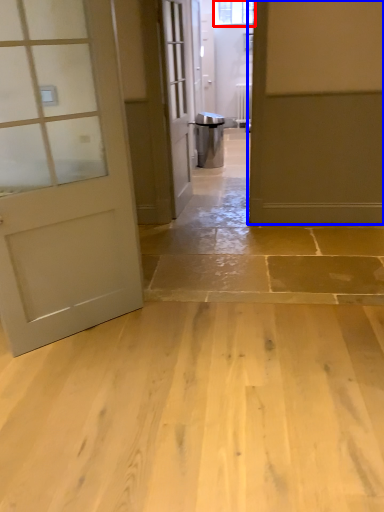
Question: Which object appears farthest to the camera in this image, window (highlighted by a red box) or door (highlighted by a blue box)?

Choices:
 (A) window
 (B) door

Answer: (A)